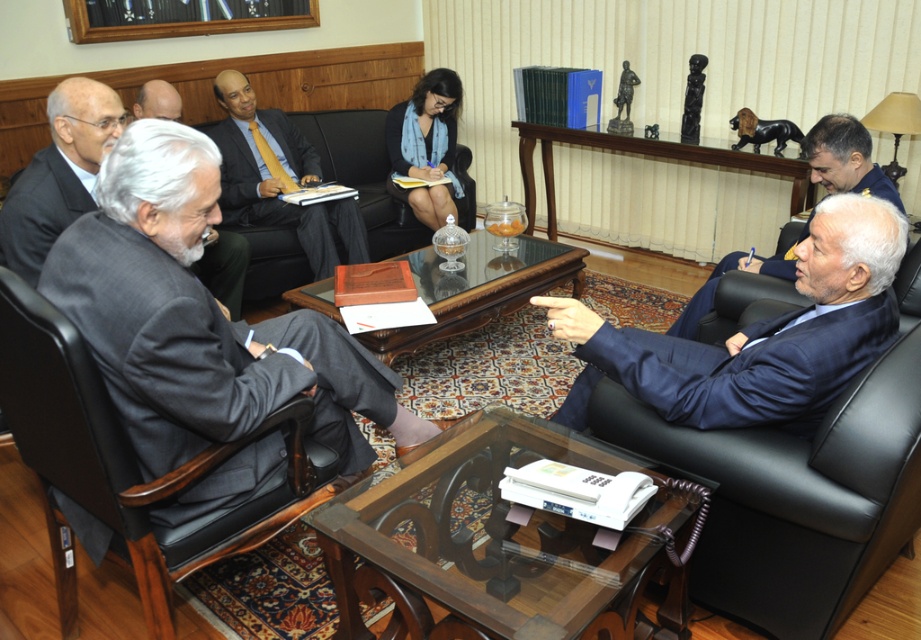
You are an interior designer observing the formal meeting setup. You need to determine the spatial relationship between the transparent glass table at center and the dark blue suit at right. Which object is positioned lower in the scene?

The transparent glass table at center is positioned lower than the dark blue suit at right, as it is described to be below it.